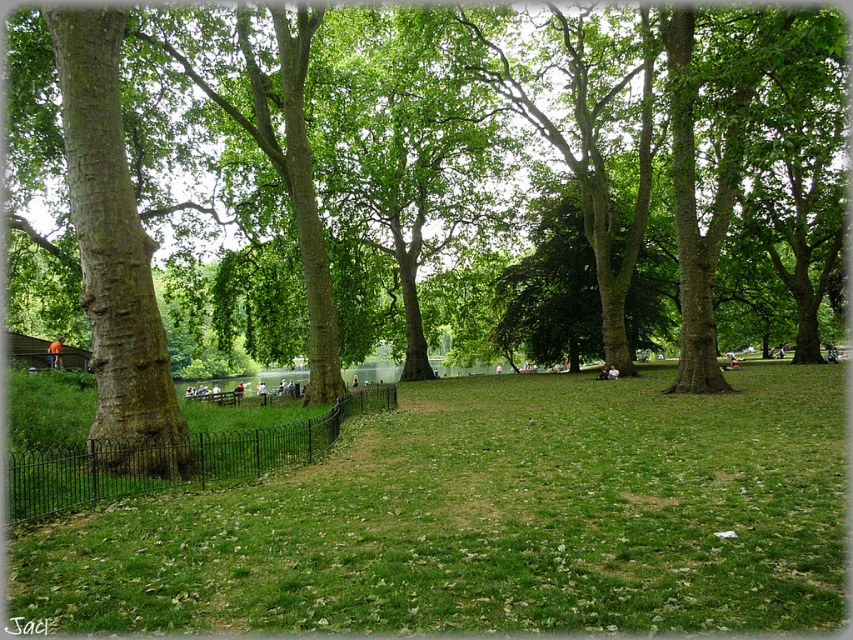
Question: Is green matte tree at left above green grassy area at center?

Choices:
 (A) yes
 (B) no

Answer: (A)

Question: Is green matte tree at left to the left of green grassy area at center from the viewer's perspective?

Choices:
 (A) yes
 (B) no

Answer: (A)

Question: Is green matte tree at left wider than black wrought iron fence at lower left?

Choices:
 (A) no
 (B) yes

Answer: (B)

Question: Estimate the real-world distances between objects in this image. Which object is closer to the green matte tree at left?

Choices:
 (A) black wrought iron fence at lower left
 (B) green grassy area at center

Answer: (B)

Question: Which object is farther from the camera taking this photo?

Choices:
 (A) green grassy area at center
 (B) green matte tree at left
 (C) black wrought iron fence at lower left

Answer: (B)

Question: Considering the real-world distances, which object is farthest from the green grassy area at center?

Choices:
 (A) black wrought iron fence at lower left
 (B) green matte tree at left

Answer: (B)